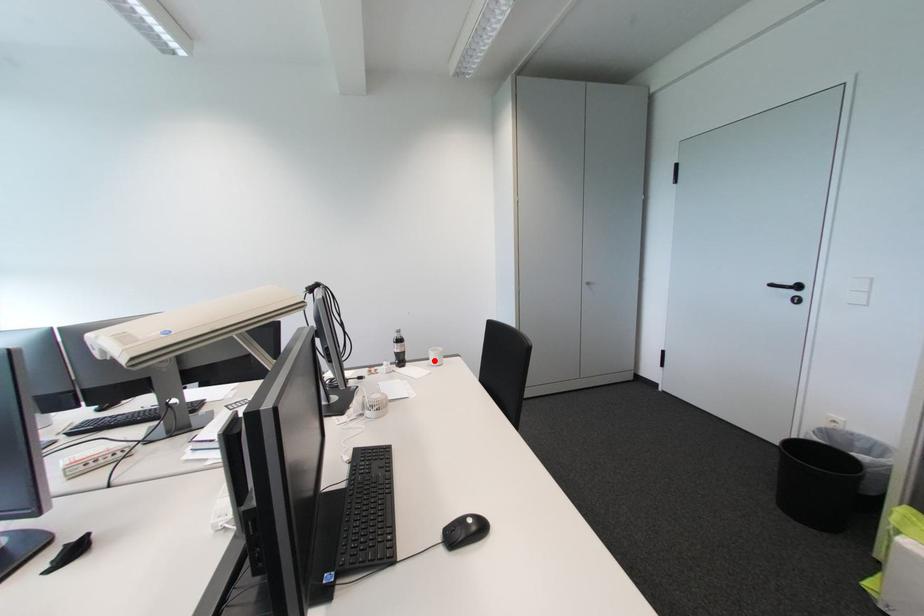
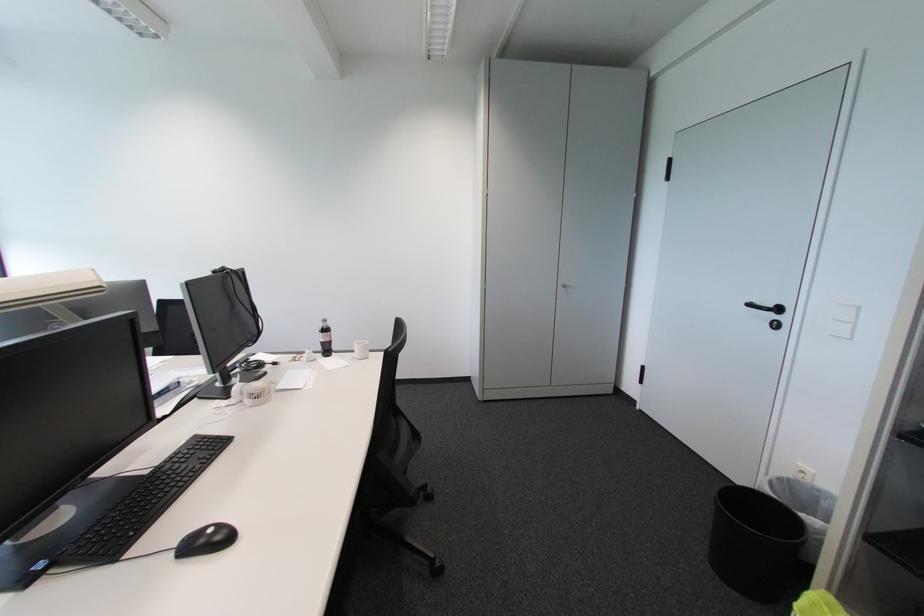
Question: I am providing you with two images of the same scene from different viewpoints. Image1 has a red point marked. In image2, the corresponding 3D location appears at what relative position? Reply with the corresponding letter.

Choices:
 (A) Closer
 (B) Farther

Answer: (B)